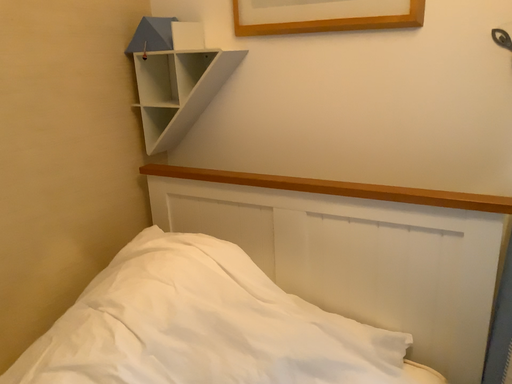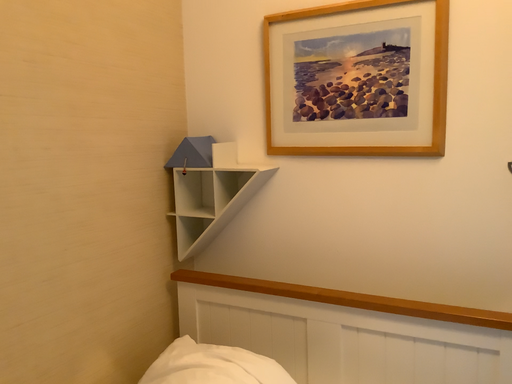
Question: How did the camera likely rotate when shooting the video?

Choices:
 (A) rotated upward
 (B) rotated downward

Answer: (A)